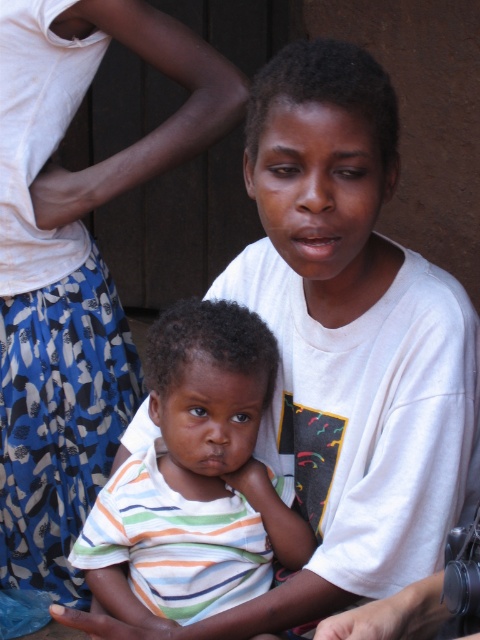
Question: Is white cotton shirt at upper center positioned in front of striped cotton shirt at center?

Choices:
 (A) no
 (B) yes

Answer: (A)

Question: In this image, where is white cotton shirt at upper center located relative to striped cotton shirt at center?

Choices:
 (A) left
 (B) right

Answer: (A)

Question: Which point appears closest to the camera in this image?

Choices:
 (A) (12, 504)
 (B) (181, 304)

Answer: (B)

Question: Which of the following is the farthest from the observer?

Choices:
 (A) (263, 497)
 (B) (66, 8)

Answer: (B)

Question: Among these objects, which one is farthest from the camera?

Choices:
 (A) white cotton shirt at upper center
 (B) striped cotton shirt at center

Answer: (A)

Question: Is white cotton shirt at upper center closer to camera compared to striped cotton shirt at center?

Choices:
 (A) no
 (B) yes

Answer: (A)